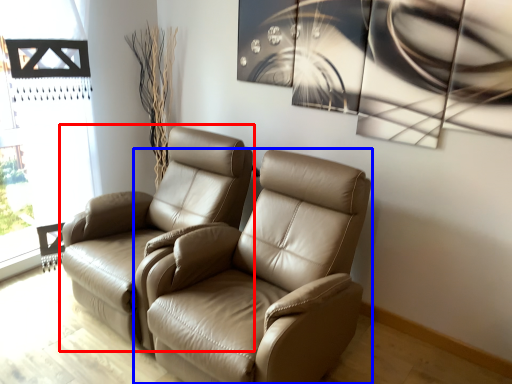
Question: Which object appears farthest to the camera in this image, chair (highlighted by a red box) or chair (highlighted by a blue box)?

Choices:
 (A) chair
 (B) chair

Answer: (A)